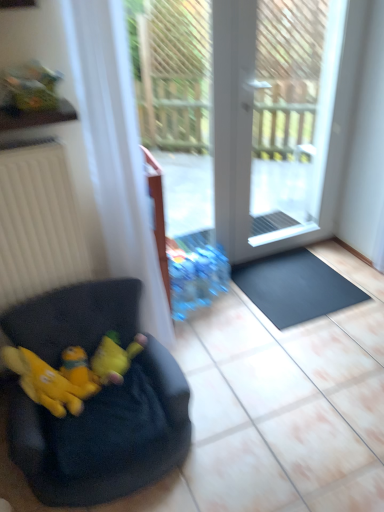
Identify the location of empty space that is ontop of black rubber doormat at lower right. This screenshot has width=384, height=512. (x=288, y=279).